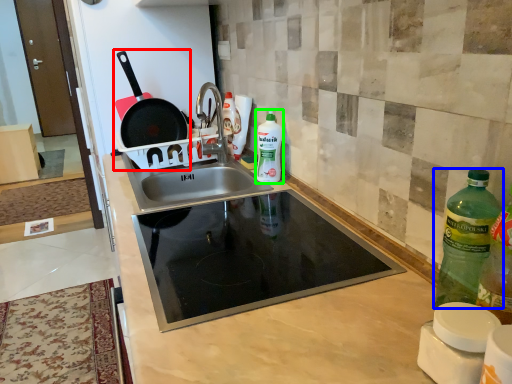
Question: Which object is the closest to the frying pan (highlighted by a red box)? Choose among these: bottle (highlighted by a blue box) or bottle (highlighted by a green box).

Choices:
 (A) bottle
 (B) bottle

Answer: (B)